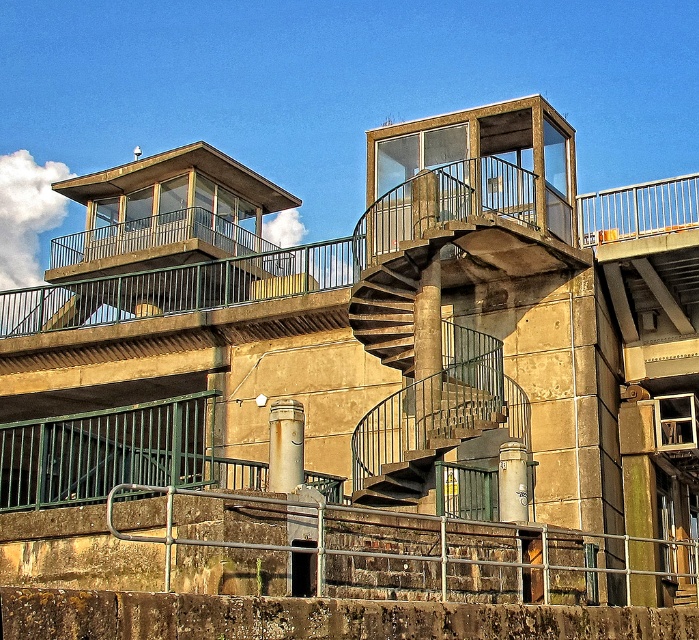
Is rusty metal railing at lower center smaller than rusty metal pipe at center?

Incorrect, rusty metal railing at lower center is not smaller in size than rusty metal pipe at center.

Can you confirm if rusty metal railing at lower center is positioned below rusty metal pipe at center?

Indeed, rusty metal railing at lower center is positioned under rusty metal pipe at center.

At what (x,y) coordinates should I click in order to perform the action: click on rusty metal railing at lower center. Please return your answer as a coordinate pair (x, y). The width and height of the screenshot is (699, 640). Looking at the image, I should click on (415, 552).

Which is more to the right, rusty metal railing at lower center or dark brown metal stairs at center?

From the viewer's perspective, rusty metal railing at lower center appears more on the right side.

Image resolution: width=699 pixels, height=640 pixels. What do you see at coordinates (415, 552) in the screenshot?
I see `rusty metal railing at lower center` at bounding box center [415, 552].

Locate an element on the screen. Image resolution: width=699 pixels, height=640 pixels. rusty metal railing at lower center is located at coordinates (415, 552).

Is dark brown metal stairs at center in front of metallic gray cylinder at lower center?

No.

Can you confirm if dark brown metal stairs at center is positioned to the right of metallic gray cylinder at lower center?

No, dark brown metal stairs at center is not to the right of metallic gray cylinder at lower center.

What do you see at coordinates (398, 481) in the screenshot?
I see `dark brown metal stairs at center` at bounding box center [398, 481].

The height and width of the screenshot is (640, 699). What are the coordinates of `dark brown metal stairs at center` in the screenshot? It's located at (398, 481).